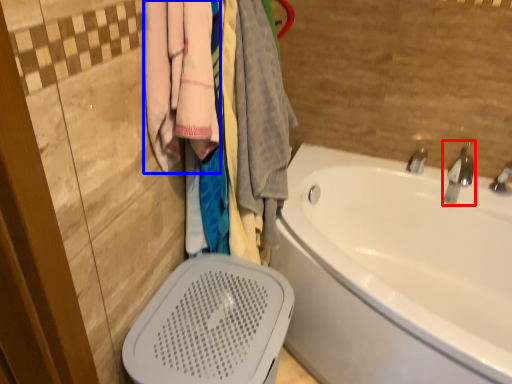
Question: Among these objects, which one is farthest to the camera, tap (highlighted by a red box) or clothing (highlighted by a blue box)?

Choices:
 (A) tap
 (B) clothing

Answer: (A)